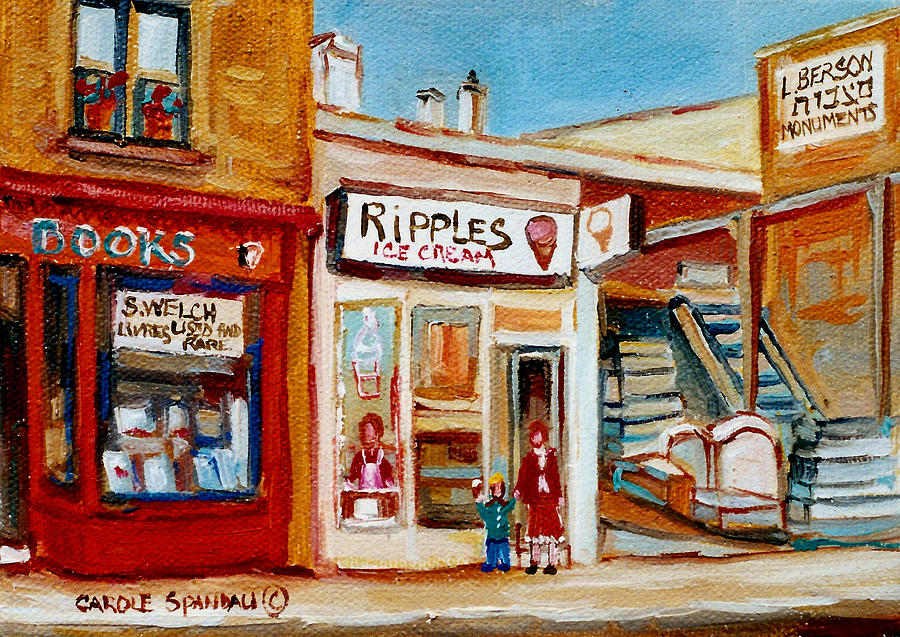
I want to click on window, so click(x=379, y=409).